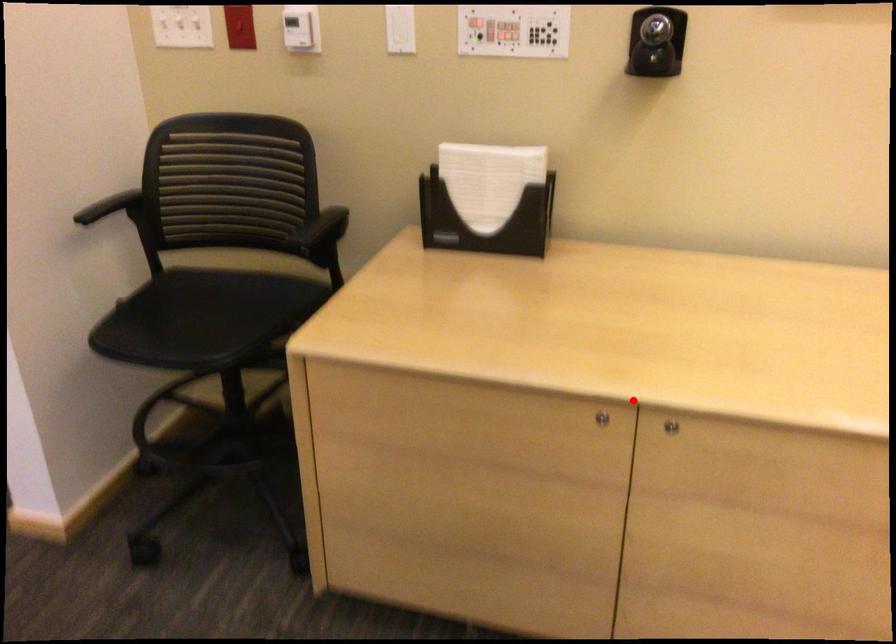
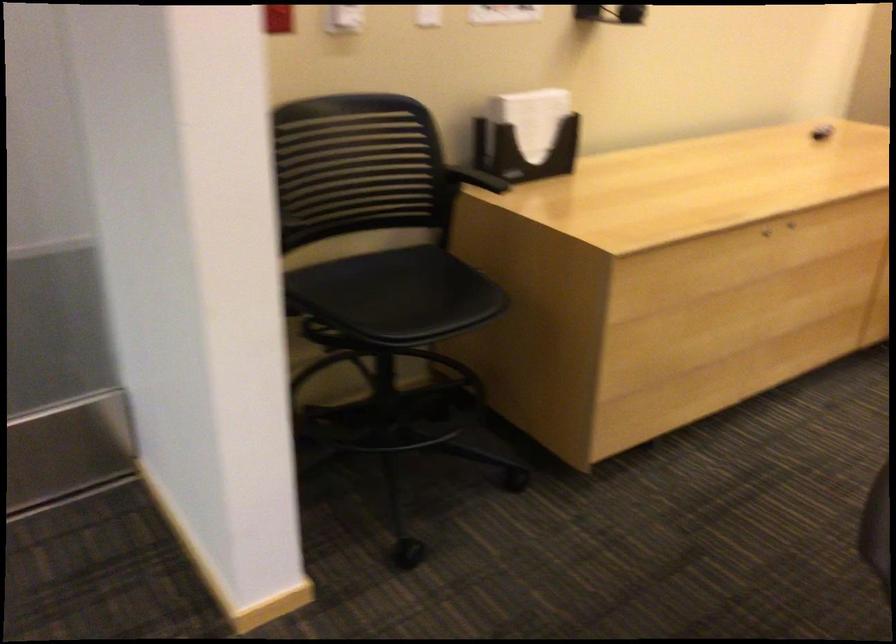
Question: I am providing you with two images of the same scene from different viewpoints. Given a red point in image1, look at the same physical point in image2. Is it:

Choices:
 (A) Closer to the viewpoint
 (B) Farther from the viewpoint

Answer: (B)